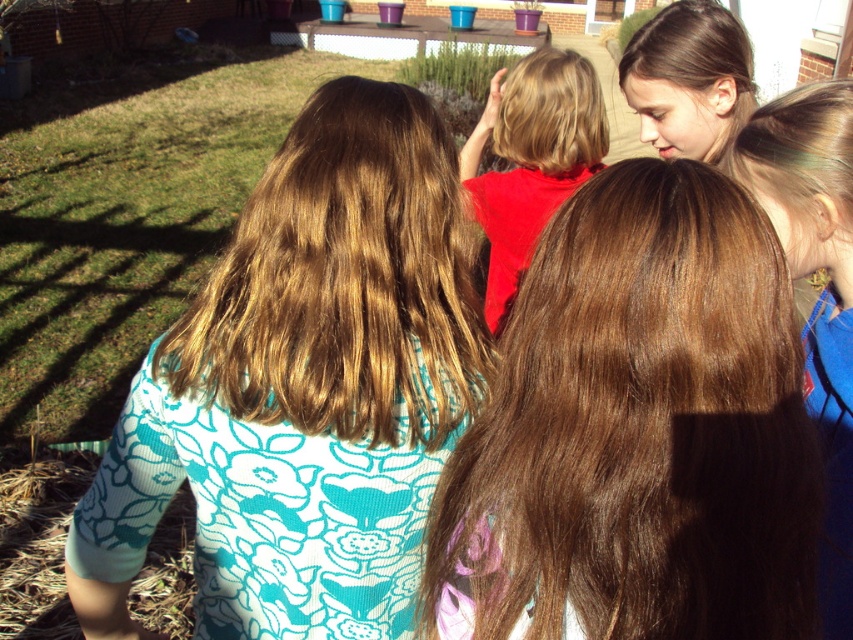
Where is `brown silky hair at center`? brown silky hair at center is located at coordinates (637, 432).

Image resolution: width=853 pixels, height=640 pixels. What do you see at coordinates (637, 432) in the screenshot? I see `brown silky hair at center` at bounding box center [637, 432].

Which is in front, point (566, 497) or point (627, 76)?

Point (566, 497) is more forward.

You are a GUI agent. You are given a task and a screenshot of the screen. Output one action in this format:
    pyautogui.click(x=<x>, y=<y>)
    Task: Click on the brown silky hair at center
    The height and width of the screenshot is (640, 853).
    Given the screenshot: What is the action you would take?
    pyautogui.click(x=637, y=432)

Which is in front, point (369, 268) or point (486, 118)?

Positioned in front is point (369, 268).

Who is positioned more to the right, brown wavy hair at center or matte red shirt at center?

matte red shirt at center

This screenshot has width=853, height=640. I want to click on brown wavy hair at center, so click(344, 280).

Based on the photo, measure the distance between brown silky hair at center and brown hair at upper right.

brown silky hair at center and brown hair at upper right are 9.40 inches apart.

Between point (527, 326) and point (836, 93), which one is positioned behind?

The point (836, 93) is more distant.

You are a GUI agent. You are given a task and a screenshot of the screen. Output one action in this format:
    pyautogui.click(x=<x>, y=<y>)
    Task: Click on the brown silky hair at center
    
    Given the screenshot: What is the action you would take?
    pyautogui.click(x=637, y=432)

You are a GUI agent. You are given a task and a screenshot of the screen. Output one action in this format:
    pyautogui.click(x=<x>, y=<y>)
    Task: Click on the brown silky hair at center
    This screenshot has height=640, width=853.
    Given the screenshot: What is the action you would take?
    pyautogui.click(x=637, y=432)